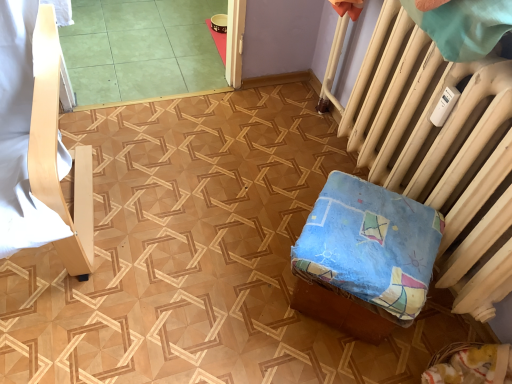
At what (x,y) coordinates should I click in order to perform the action: click on free area in between light wood chair at left, which is the second furniture from right to left, and white painted radiator at right. Please return your answer as a coordinate pair (x, y). This screenshot has width=512, height=384. Looking at the image, I should click on (208, 214).